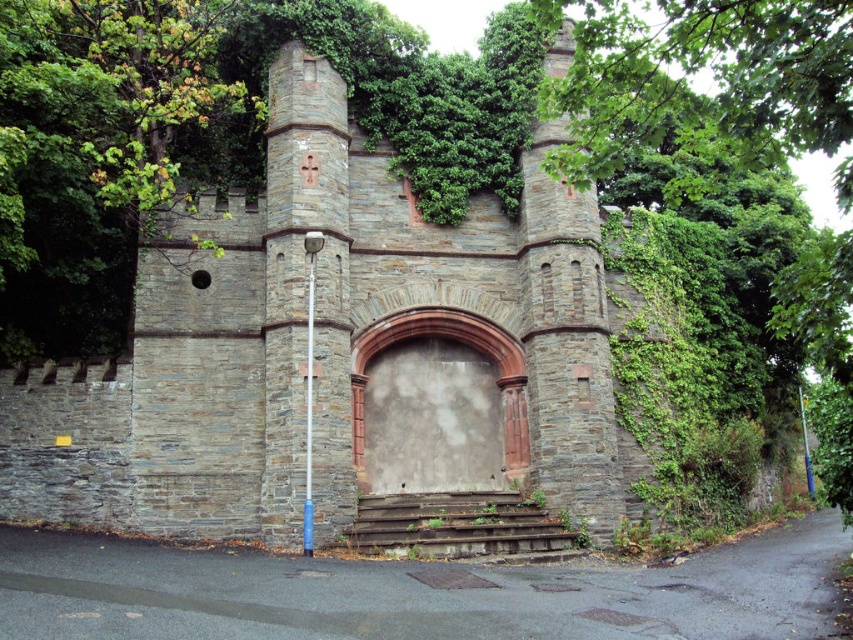
Who is more forward, (308, 536) or (804, 428)?

Point (308, 536)

Is point (309, 458) closer to viewer compared to point (799, 401)?

Yes, point (309, 458) is in front of point (799, 401).

Between point (308, 323) and point (808, 461), which one is positioned behind?

Positioned behind is point (808, 461).

Where is `blue plastic pole at center`? The width and height of the screenshot is (853, 640). blue plastic pole at center is located at coordinates (309, 413).

In the scene shown: Does stone wall gate at center have a smaller size compared to rusty metal stairs at center?

No, stone wall gate at center is not smaller than rusty metal stairs at center.

Who is more forward, (111, 403) or (390, 522)?

Point (390, 522) is more forward.

Which is in front, point (482, 369) or point (505, 538)?

Point (505, 538) is in front.

The width and height of the screenshot is (853, 640). I want to click on stone wall gate at center, so click(335, 353).

Which is more to the left, rusty metal stairs at center or blue metallic pole at center?

Positioned to the left is rusty metal stairs at center.

Is point (450, 540) positioned behind point (805, 472)?

No.

Where is `rusty metal stairs at center`? Image resolution: width=853 pixels, height=640 pixels. rusty metal stairs at center is located at coordinates (454, 525).